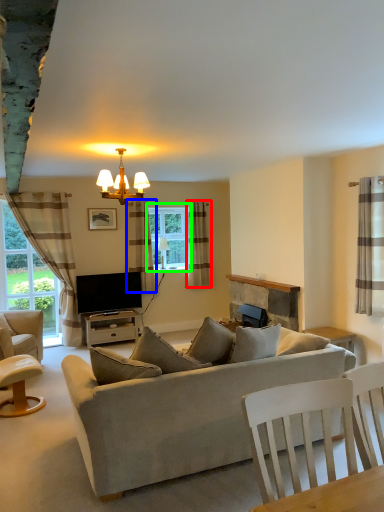
Question: Based on their relative distances, which object is nearer to curtain (highlighted by a red box)? Choose from curtain (highlighted by a blue box) and window (highlighted by a green box).

Choices:
 (A) curtain
 (B) window

Answer: (B)